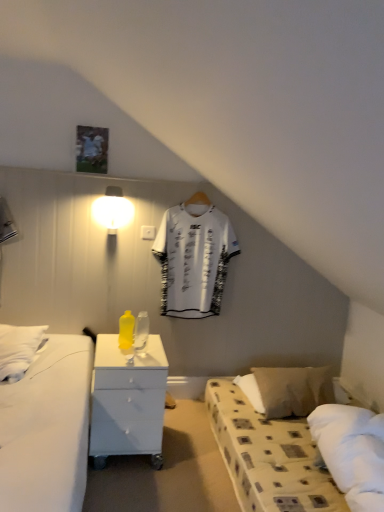
Question: Considering the positions of beige fabric pillow at lower right and transparent glass bottle at center, marked as the 2th bottle in a left-to-right arrangement, in the image, is beige fabric pillow at lower right taller or shorter than transparent glass bottle at center, marked as the 2th bottle in a left-to-right arrangement,?

Choices:
 (A) tall
 (B) short

Answer: (B)

Question: In terms of size, does beige fabric pillow at lower right appear bigger or smaller than transparent glass bottle at center, marked as the 2th bottle in a left-to-right arrangement?

Choices:
 (A) small
 (B) big

Answer: (B)

Question: Which of these objects is positioned closest to the beige fabric pillow at lower right?

Choices:
 (A) white glossy nightstand at center
 (B) yellow matte bottle at center, which appears as the second bottle when viewed from the right
 (C) white jersey at center
 (D) transparent glass bottle at center, acting as the 1th bottle starting from the right
 (E) white glossy wall lamp at upper left

Answer: (C)

Question: Estimate the real-world distances between objects in this image. Which object is farther from the beige fabric pillow at lower right?

Choices:
 (A) white glossy nightstand at center
 (B) white glossy wall lamp at upper left
 (C) transparent glass bottle at center, acting as the 1th bottle starting from the right
 (D) white jersey at center
 (E) yellow matte bottle at center, which appears as the second bottle when viewed from the right

Answer: (B)